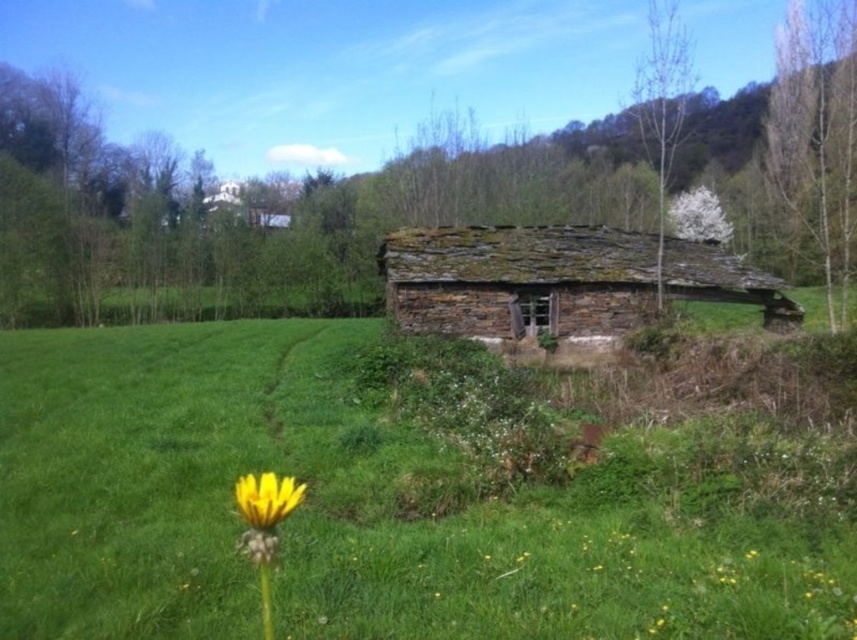
Which is below, green grassy at center or rusty stone log cabin at center?

green grassy at center is below.

Is green grassy at center to the right of rusty stone log cabin at center from the viewer's perspective?

In fact, green grassy at center is to the left of rusty stone log cabin at center.

The width and height of the screenshot is (857, 640). What do you see at coordinates (352, 509) in the screenshot?
I see `green grassy at center` at bounding box center [352, 509].

Where is `green grassy at center`? The image size is (857, 640). green grassy at center is located at coordinates (352, 509).

In the scene shown: Does green grassy at center have a smaller size compared to yellow matte flower at lower left?

No, green grassy at center is not smaller than yellow matte flower at lower left.

The image size is (857, 640). I want to click on green grassy at center, so click(x=352, y=509).

Does rusty stone log cabin at center lie behind yellow matte flower at lower left?

That is True.

Can you confirm if rusty stone log cabin at center is positioned to the left of yellow matte flower at lower left?

Incorrect, rusty stone log cabin at center is not on the left side of yellow matte flower at lower left.

Does point (700, 248) come farther from viewer compared to point (270, 522)?

Yes, it is behind point (270, 522).

Locate an element on the screen. This screenshot has width=857, height=640. rusty stone log cabin at center is located at coordinates (520, 280).